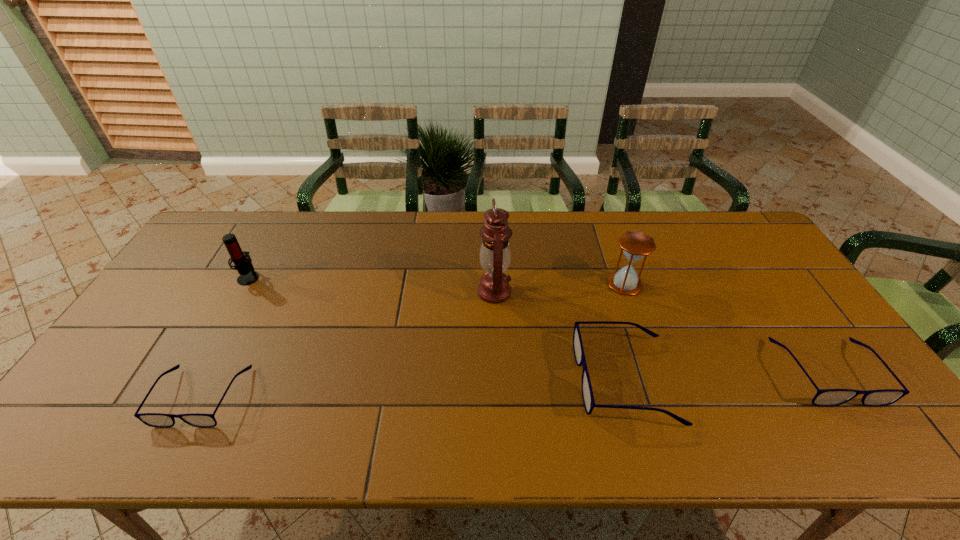
Where is `vacant space at the far left corner of the desktop`? The width and height of the screenshot is (960, 540). vacant space at the far left corner of the desktop is located at coordinates [230, 217].

The height and width of the screenshot is (540, 960). What are the coordinates of `free region at the near right corner of the desktop` in the screenshot? It's located at (853, 403).

This screenshot has height=540, width=960. In order to click on free spot between the hourglass and the microphone in this screenshot , I will do `click(437, 281)`.

The width and height of the screenshot is (960, 540). Identify the location of free space that is in between the microphone and the hourglass. (437, 281).

Where is `blank region between the hourglass and the fourth object from right to left`? The image size is (960, 540). blank region between the hourglass and the fourth object from right to left is located at coordinates 560,288.

At what (x,y) coordinates should I click in order to perform the action: click on vacant area that lies between the shortest spectacles and the hourglass. Please return your answer as a coordinate pair (x, y). This screenshot has width=960, height=540. Looking at the image, I should click on (414, 340).

Locate an element on the screen. vacant area that lies between the second shortest spectacles and the microphone is located at coordinates (538, 325).

Locate an element on the screen. This screenshot has width=960, height=540. unoccupied area between the leftmost spectacles and the second spectacles from left to right is located at coordinates (414, 388).

Locate an element on the screen. empty location between the hourglass and the microphone is located at coordinates coord(437,281).

You are a GUI agent. You are given a task and a screenshot of the screen. Output one action in this format:
    pyautogui.click(x=<x>, y=<y>)
    Task: Click on the free space between the hourglass and the second spectacles from left to right
    The height and width of the screenshot is (540, 960).
    Given the screenshot: What is the action you would take?
    pyautogui.click(x=625, y=332)